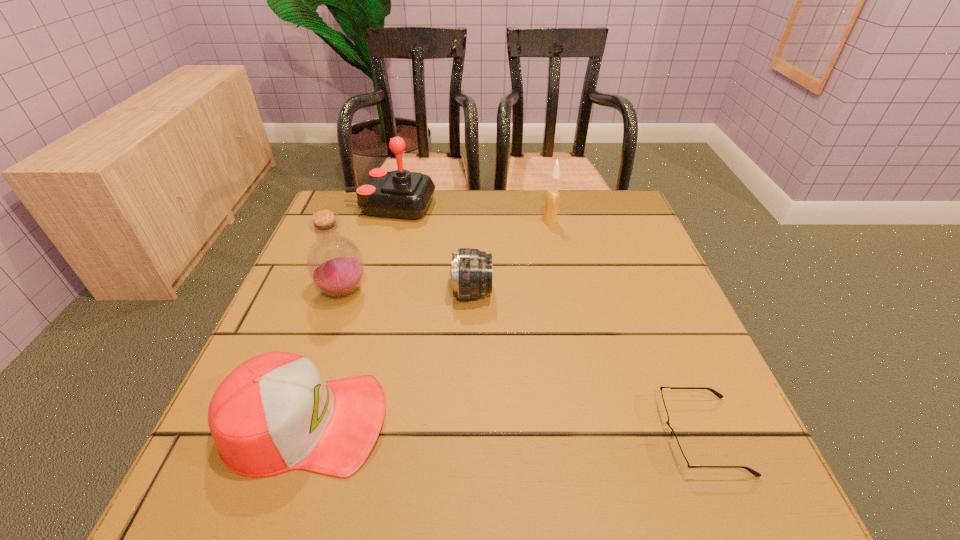
Where is `joystick`? The height and width of the screenshot is (540, 960). joystick is located at coordinates (403, 194).

Identify the location of bottle. The height and width of the screenshot is (540, 960). (335, 265).

Identify the location of candle. (552, 196).

Locate an element on the screen. Image resolution: width=960 pixels, height=540 pixels. baseball cap is located at coordinates (274, 413).

The image size is (960, 540). Identify the location of the fourth object from left to right. (471, 269).

Where is `the shortest object`? the shortest object is located at coordinates (677, 452).

Locate an element on the screen. The image size is (960, 540). the rightmost object is located at coordinates (677, 452).

This screenshot has width=960, height=540. What are the coordinates of `vacant space located 0.260m on the right of the joystick` in the screenshot? It's located at (531, 206).

This screenshot has height=540, width=960. In order to click on blank space located on the right of the bottle in this screenshot , I will do `click(448, 291)`.

Locate an element on the screen. vacant region located on the back of the candle is located at coordinates (545, 202).